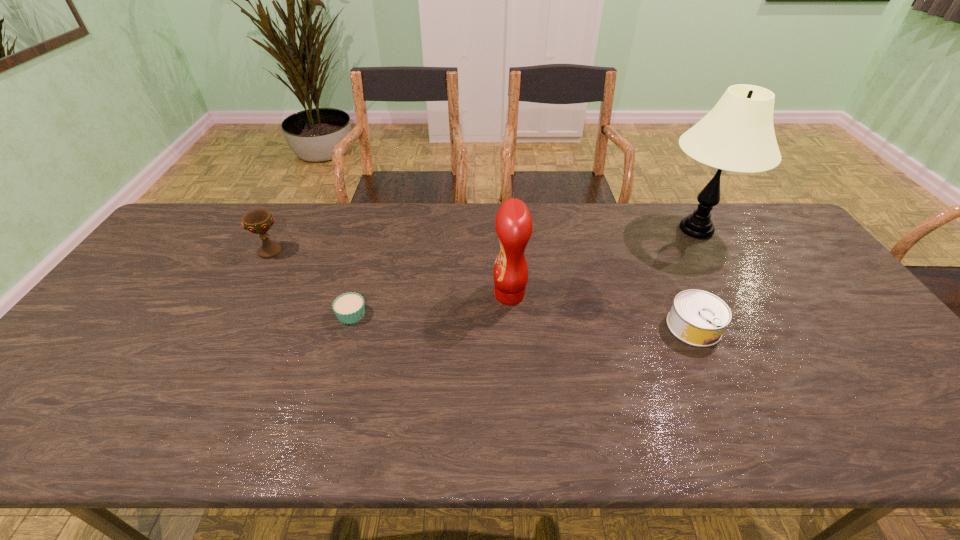
Image resolution: width=960 pixels, height=540 pixels. I want to click on object that is the fourth closest to the can, so click(259, 221).

The image size is (960, 540). Find the location of `free region that satisfies the following two spatial constraints: 1. on the label side of the third object from right to left; 2. on the left side of the can`. free region that satisfies the following two spatial constraints: 1. on the label side of the third object from right to left; 2. on the left side of the can is located at coordinates (512, 327).

At what (x,y) coordinates should I click in order to perform the action: click on free spot that satisfies the following two spatial constraints: 1. on the label side of the condiment; 2. on the right side of the fourth tallest object. Please return your answer as a coordinate pair (x, y). The width and height of the screenshot is (960, 540). Looking at the image, I should click on (512, 327).

Identify the location of free space that satisfies the following two spatial constraints: 1. on the label side of the condiment; 2. on the left side of the can. This screenshot has height=540, width=960. (512, 327).

This screenshot has width=960, height=540. I want to click on free space that satisfies the following two spatial constraints: 1. on the back side of the tallest object; 2. on the left side of the fourth object from right to left, so click(x=375, y=230).

Find the location of a particular element. Image resolution: width=960 pixels, height=540 pixels. vacant position in the image that satisfies the following two spatial constraints: 1. on the label side of the second tallest object; 2. on the back side of the second shortest object is located at coordinates (512, 327).

At what (x,y) coordinates should I click in order to perform the action: click on vacant point that satisfies the following two spatial constraints: 1. on the back side of the second shortest object; 2. on the label side of the third object from right to left. Please return your answer as a coordinate pair (x, y). The height and width of the screenshot is (540, 960). Looking at the image, I should click on point(679,295).

Where is `vacant space that satisfies the following two spatial constraints: 1. on the back side of the second shortest object; 2. on the label side of the third object from right to left`? Image resolution: width=960 pixels, height=540 pixels. vacant space that satisfies the following two spatial constraints: 1. on the back side of the second shortest object; 2. on the label side of the third object from right to left is located at coordinates (679, 295).